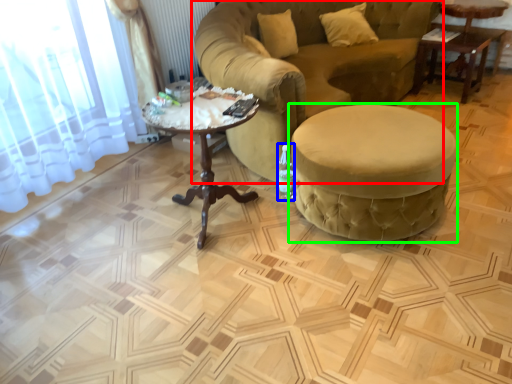
Question: Estimate the real-world distances between objects in this image. Which object is closer to studio couch (highlighted by a red box), bottle (highlighted by a blue box) or table (highlighted by a green box)?

Choices:
 (A) bottle
 (B) table

Answer: (B)